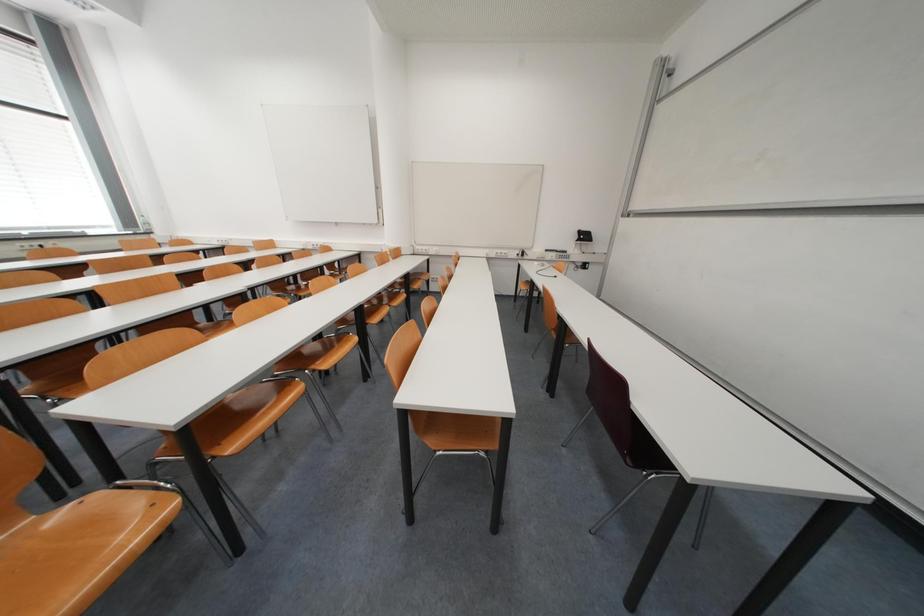
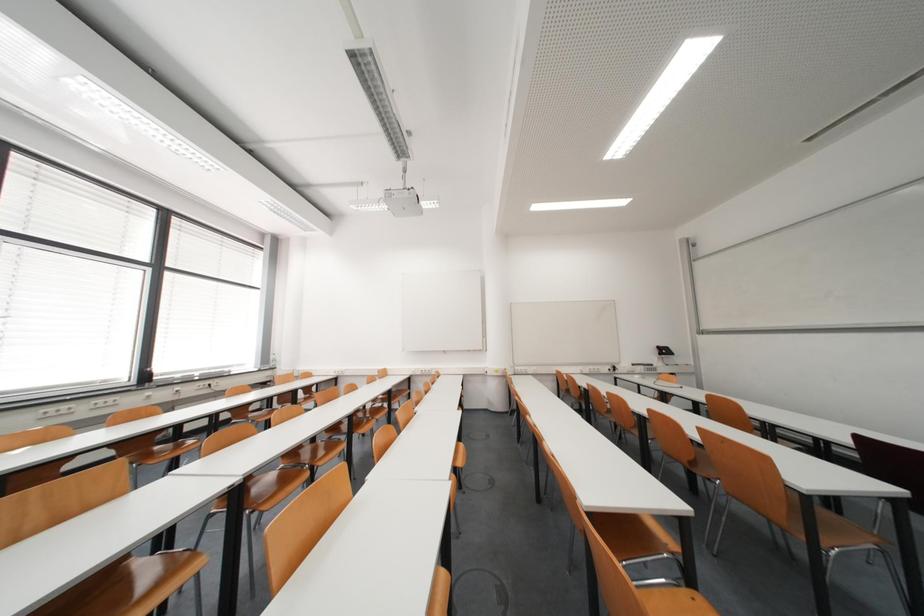
Question: What movement of the cameraman would produce the second image?

Choices:
 (A) Left
 (B) Right
 (C) Forward
 (D) Backward

Answer: (A)